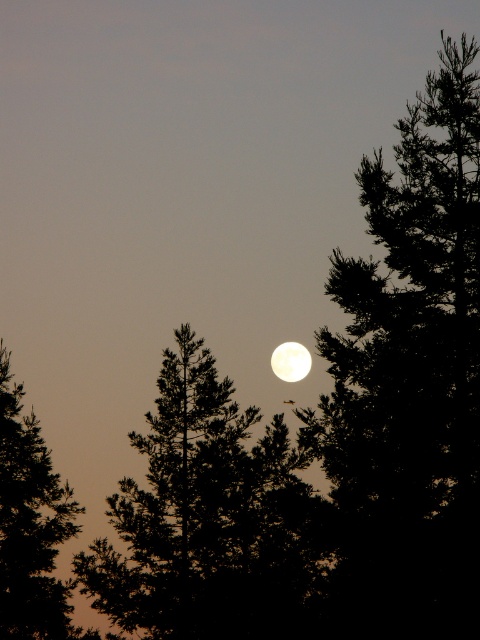
You are an astronomer observing the night sky. You notice the dark green leafy tree at left and the bright white sphere at center. Which object is positioned higher in the sky?

The bright white sphere at center is positioned higher in the sky than the dark green leafy tree at left.

You are an astronomer observing the night sky. You notice a silhouette pine tree at center and a bright white sphere at center. Which object is closer to you?

The silhouette pine tree at center is closer to the viewer than the bright white sphere at center.